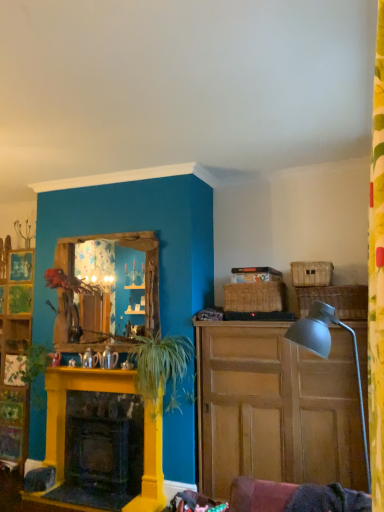
I want to click on matte gray lamp at right, so click(x=328, y=351).

In order to face green leafy plant at left, which ranks as the 1th plant in left-to-right order, should I rotate leftwards or rightwards?

A 20.189 degree turn to the left will do.

Image resolution: width=384 pixels, height=512 pixels. Describe the element at coordinates (115, 278) in the screenshot. I see `wooden mirror at center` at that location.

What do you see at coordinates (255, 297) in the screenshot?
I see `woven brown picnic basket at upper right, marked as the 1th picnic basket in a left-to-right arrangement` at bounding box center [255, 297].

I want to click on green leafy plant at center, which is the 1th plant in right-to-left order, so 160,367.

Describe the element at coordinates (275, 408) in the screenshot. I see `wooden cabinet at right` at that location.

Locate an element on the screen. The width and height of the screenshot is (384, 512). matte gray lamp at right is located at coordinates (328, 351).

Considering the sizes of woven brown picnic basket at upper right, which is counted as the third picnic basket, starting from the right, and wooden mirror at center in the image, is woven brown picnic basket at upper right, which is counted as the third picnic basket, starting from the right, wider or thinner than wooden mirror at center?

In the image, woven brown picnic basket at upper right, which is counted as the third picnic basket, starting from the right, appears to be wider than wooden mirror at center.

How different are the orientations of woven brown picnic basket at upper right, marked as the 1th picnic basket in a left-to-right arrangement, and wooden mirror at center in degrees?

1.04 degrees separate the facing orientations of woven brown picnic basket at upper right, marked as the 1th picnic basket in a left-to-right arrangement, and wooden mirror at center.

Is woven brown picnic basket at upper right, which is counted as the third picnic basket, starting from the right, closer to the viewer compared to wooden mirror at center?

Yes, it is.

Which is further, (294, 264) or (362, 406)?

Positioned behind is point (294, 264).

Can we say woven brown picnic basket at upper right, which is the second picnic basket in left-to-right order, lies outside matte gray lamp at right?

Absolutely, woven brown picnic basket at upper right, which is the second picnic basket in left-to-right order, is external to matte gray lamp at right.

Is woven brown picnic basket at upper right, which is the second picnic basket in left-to-right order, taller or shorter than matte gray lamp at right?

In the image, woven brown picnic basket at upper right, which is the second picnic basket in left-to-right order, appears to be shorter than matte gray lamp at right.

The width and height of the screenshot is (384, 512). I want to click on table lamp in front of the woven brown picnic basket at upper right, which is the second picnic basket in left-to-right order, so click(328, 351).

Looking at this image, does green leafy plant at center, which is the 1th plant in right-to-left order, have a smaller size compared to yellow painted wood fireplace at lower left?

Yes, green leafy plant at center, which is the 1th plant in right-to-left order, is smaller than yellow painted wood fireplace at lower left.

From the image's perspective, is green leafy plant at center, positioned as the second plant in left-to-right order, on top of yellow painted wood fireplace at lower left?

Indeed, from the image's perspective, green leafy plant at center, positioned as the second plant in left-to-right order, is shown above yellow painted wood fireplace at lower left.

Is green leafy plant at center, positioned as the second plant in left-to-right order, looking in the opposite direction of yellow painted wood fireplace at lower left?

green leafy plant at center, positioned as the second plant in left-to-right order, does not have its back to yellow painted wood fireplace at lower left.

Which is more to the right, green leafy plant at center, which is the 1th plant in right-to-left order, or yellow painted wood fireplace at lower left?

Positioned to the right is green leafy plant at center, which is the 1th plant in right-to-left order.

Is wooden mirror at center smaller than woven brown picnic basket at upper right, which is the second picnic basket in left-to-right order?

Actually, wooden mirror at center might be larger than woven brown picnic basket at upper right, which is the second picnic basket in left-to-right order.

Consider the image. From a real-world perspective, which object stands above the other?

woven brown picnic basket at upper right, which is the second picnic basket in left-to-right order.

Starting from the wooden mirror at center, which picnic basket is the 2nd one in front? Please provide its 2D coordinates.

[(311, 273)]

Looking at this image, from the image's perspective, which is below, wooden mirror at center or woven brown picnic basket at upper right, which is the second picnic basket in left-to-right order?

wooden mirror at center appears lower in the image.

Who is smaller, yellow painted wood fireplace at lower left or wooden cabinet at right?

Smaller between the two is yellow painted wood fireplace at lower left.

Does yellow painted wood fireplace at lower left have a lesser height compared to wooden cabinet at right?

Indeed, yellow painted wood fireplace at lower left has a lesser height compared to wooden cabinet at right.

Is wooden cabinet at right completely or partially inside yellow painted wood fireplace at lower left?

That's incorrect, wooden cabinet at right is not inside yellow painted wood fireplace at lower left.

Which point is more forward, (282,310) or (306,277)?

Point (306,277)

From a real-world perspective, which is physically above, woven brown picnic basket at upper right, marked as the 1th picnic basket in a left-to-right arrangement, or woven brown picnic basket at upper right, acting as the 2th picnic basket starting from the right?

From a 3D spatial view, woven brown picnic basket at upper right, acting as the 2th picnic basket starting from the right, is above.

Is woven brown picnic basket at upper right, which is counted as the third picnic basket, starting from the right, further to the viewer compared to woven brown picnic basket at upper right, acting as the 2th picnic basket starting from the right?

Yes, it is behind woven brown picnic basket at upper right, acting as the 2th picnic basket starting from the right.

Which object is positioned more to the left, woven brown picnic basket at upper right, marked as the 1th picnic basket in a left-to-right arrangement, or woven brown picnic basket at upper right, acting as the 2th picnic basket starting from the right?

Positioned to the left is woven brown picnic basket at upper right, marked as the 1th picnic basket in a left-to-right arrangement.

How many degrees apart are the facing directions of matte gray lamp at right and green leafy plant at center, positioned as the second plant in left-to-right order?

90.4 degrees separate the facing orientations of matte gray lamp at right and green leafy plant at center, positioned as the second plant in left-to-right order.

Would you say matte gray lamp at right is to the left or to the right of green leafy plant at center, positioned as the second plant in left-to-right order, in the picture?

matte gray lamp at right is positioned on green leafy plant at center, positioned as the second plant in left-to-right order,'s right side.

From the picture: Which point is more distant from viewer, (365, 437) or (158, 370)?

Point (158, 370)

From a real-world perspective, between matte gray lamp at right and green leafy plant at center, positioned as the second plant in left-to-right order, who is vertically higher?

green leafy plant at center, positioned as the second plant in left-to-right order.

The width and height of the screenshot is (384, 512). Identify the location of picnic basket that is the 1st one when counting forward from the wooden mirror at center. (255, 297).

In order to click on picnic basket that is the 1st one when counting rightward from the matte gray lamp at right in this screenshot , I will do tap(311, 273).

From the picture: Based on their spatial positions, is woven brown picnic basket at upper right, acting as the 2th picnic basket starting from the right, or green leafy plant at center, which is the 1th plant in right-to-left order, closer to woven wicker picnic basket at right, the 3th picnic basket viewed from the left?

The object closer to woven wicker picnic basket at right, the 3th picnic basket viewed from the left, is woven brown picnic basket at upper right, acting as the 2th picnic basket starting from the right.

Considering their positions, is wooden cabinet at right positioned closer to green leafy plant at center, which is the 1th plant in right-to-left order, than wooden mirror at center?

wooden mirror at center.

From the image, which object appears to be nearer to green leafy plant at left, the second plant positioned from the right, woven brown picnic basket at upper right, which is the second picnic basket in left-to-right order, or green leafy plant at center, which is the 1th plant in right-to-left order?

green leafy plant at center, which is the 1th plant in right-to-left order, is closer to green leafy plant at left, the second plant positioned from the right.

Looking at this image, considering their positions, is woven brown picnic basket at upper right, which is counted as the third picnic basket, starting from the right, positioned closer to matte gray lamp at right than green leafy plant at left, the second plant positioned from the right?

Based on the image, woven brown picnic basket at upper right, which is counted as the third picnic basket, starting from the right, appears to be nearer to matte gray lamp at right.

Considering their positions, is green leafy plant at center, positioned as the second plant in left-to-right order, positioned closer to woven brown picnic basket at upper right, which is counted as the third picnic basket, starting from the right, than fluffy fabric flower at upper left?

green leafy plant at center, positioned as the second plant in left-to-right order.

Considering their positions, is wooden cabinet at right positioned further to green leafy plant at left, which ranks as the 1th plant in left-to-right order, than matte gray lamp at right?

matte gray lamp at right is further to green leafy plant at left, which ranks as the 1th plant in left-to-right order.

Looking at the image, which one is located further to woven brown picnic basket at upper right, which is counted as the third picnic basket, starting from the right, green leafy plant at left, the second plant positioned from the right, or woven brown picnic basket at upper right, which is the second picnic basket in left-to-right order?

Based on the image, green leafy plant at left, the second plant positioned from the right, appears to be further to woven brown picnic basket at upper right, which is counted as the third picnic basket, starting from the right.

When comparing their distances from wooden mirror at center, does fluffy fabric flower at upper left or woven wicker picnic basket at right, the 3th picnic basket viewed from the left, seem further?

The object further to wooden mirror at center is woven wicker picnic basket at right, the 3th picnic basket viewed from the left.

Locate an element on the screen. The width and height of the screenshot is (384, 512). picnic basket between yellow painted wood fireplace at lower left and matte gray lamp at right in the horizontal direction is located at coordinates [255, 297].

This screenshot has width=384, height=512. What are the coordinates of `table lamp between green leafy plant at left, which ranks as the 1th plant in left-to-right order, and woven brown picnic basket at upper right, which is the second picnic basket in left-to-right order` in the screenshot? It's located at (328, 351).

The image size is (384, 512). What are the coordinates of `fireplace located between green leafy plant at left, the second plant positioned from the right, and green leafy plant at center, which is the 1th plant in right-to-left order, in the left-right direction` in the screenshot? It's located at [x=100, y=444].

I want to click on mirror located between green leafy plant at left, which ranks as the 1th plant in left-to-right order, and green leafy plant at center, which is the 1th plant in right-to-left order, in the left-right direction, so click(115, 278).